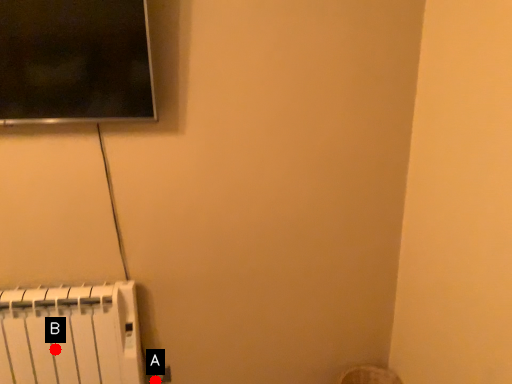
Question: Two points are circled on the image, labeled by A and B beside each circle. Which point is farther to the camera?

Choices:
 (A) A is further
 (B) B is further

Answer: (A)